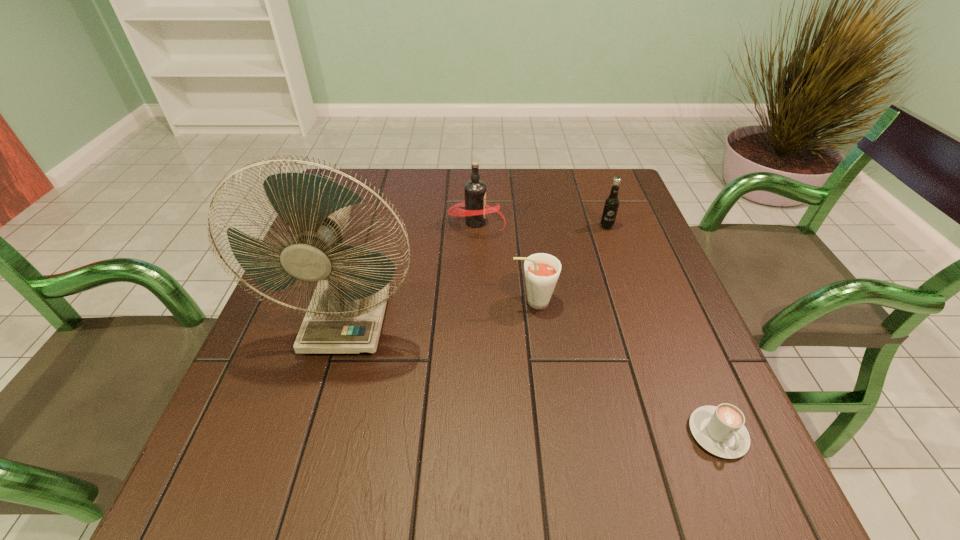
The height and width of the screenshot is (540, 960). Find the location of `free spot that satisfies the following two spatial constraints: 1. on the label of the fourth shortest object; 2. on the front-facing side of the leftmost object`. free spot that satisfies the following two spatial constraints: 1. on the label of the fourth shortest object; 2. on the front-facing side of the leftmost object is located at coordinates (475, 321).

This screenshot has width=960, height=540. I want to click on vacant space that satisfies the following two spatial constraints: 1. on the drink side of the nearest root beer; 2. on the front-facing side of the leftmost object, so click(535, 321).